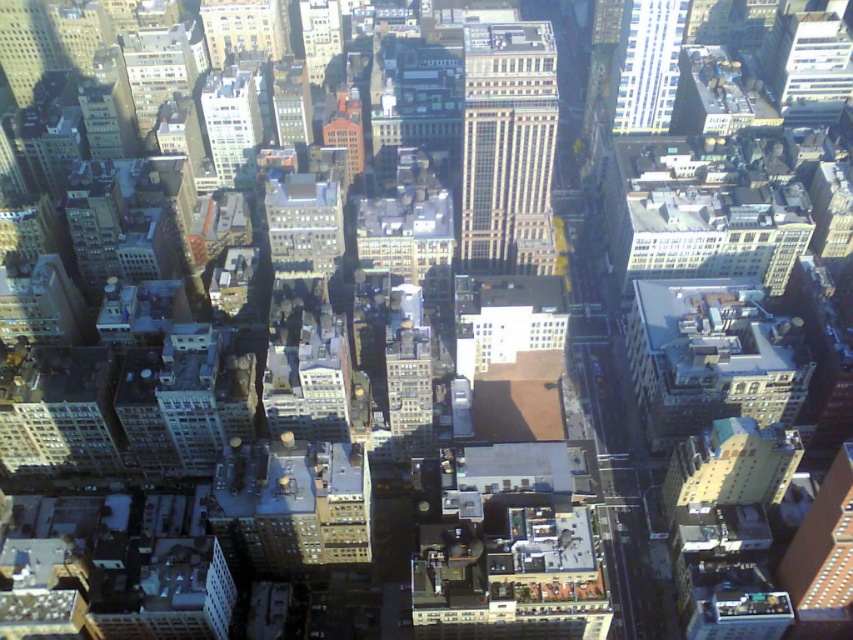
Does point (461, 230) lie behind point (396, 353)?

Yes, it is behind point (396, 353).

Does point (523, 216) lie behind point (392, 400)?

That is True.

Image resolution: width=853 pixels, height=640 pixels. I want to click on beige brick building at center, so click(x=508, y=147).

Does glassy reflective skyscraper at upper right appear under matte glass skyscraper at upper left?

No, glassy reflective skyscraper at upper right is not below matte glass skyscraper at upper left.

What do you see at coordinates (646, 65) in the screenshot? This screenshot has height=640, width=853. I see `glassy reflective skyscraper at upper right` at bounding box center [646, 65].

Is point (636, 81) positioned before point (245, 93)?

No, it is not.

Where is `glassy reflective skyscraper at upper right`? The width and height of the screenshot is (853, 640). glassy reflective skyscraper at upper right is located at coordinates (x=646, y=65).

Which is below, glassy reflective skyscraper at upper right or brick building at center?

brick building at center

What do you see at coordinates (646, 65) in the screenshot? I see `glassy reflective skyscraper at upper right` at bounding box center [646, 65].

The width and height of the screenshot is (853, 640). What are the coordinates of `glassy reflective skyscraper at upper right` in the screenshot? It's located at (646, 65).